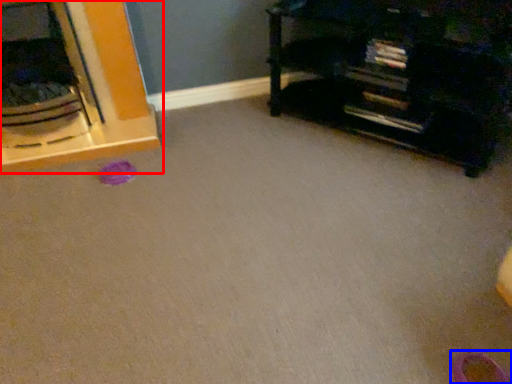
Question: Which object appears closest to the camera in this image, furniture (highlighted by a red box) or shoe (highlighted by a blue box)?

Choices:
 (A) furniture
 (B) shoe

Answer: (B)